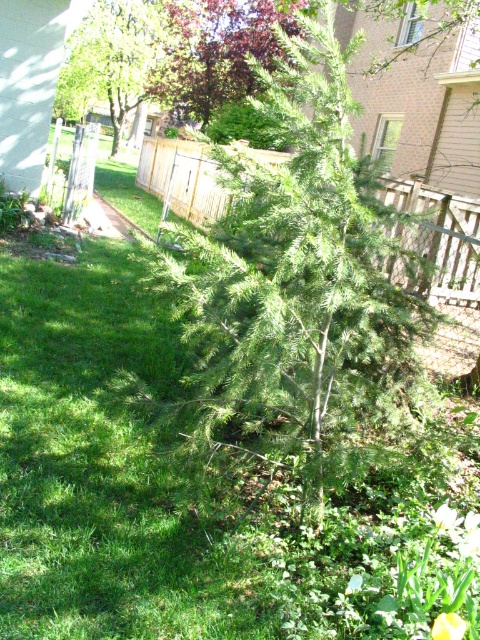
Question: Where is green leafy tree at upper left located in relation to yellow matte flower at lower right in the image?

Choices:
 (A) below
 (B) above

Answer: (B)

Question: Which object is the farthest from the green leafy tree at upper left?

Choices:
 (A) purple glossy tree at upper center
 (B) yellow matte flower at lower right

Answer: (B)

Question: Which of the following is the farthest from the observer?

Choices:
 (A) (276, 72)
 (B) (463, 630)

Answer: (A)

Question: Observing the image, what is the correct spatial positioning of green needle-like tree at center in reference to purple glossy tree at upper center?

Choices:
 (A) below
 (B) above

Answer: (A)

Question: Does green leafy tree at upper left come in front of yellow matte flower at center?

Choices:
 (A) no
 (B) yes

Answer: (A)

Question: Which object is positioned closest to the purple glossy tree at upper center?

Choices:
 (A) green leafy tree at upper left
 (B) yellow matte flower at lower right

Answer: (A)